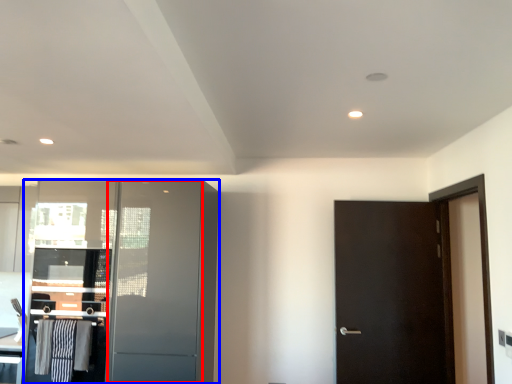
Question: Which of the following is the closest to the observer, screen door (highlighted by a red box) or cabinetry (highlighted by a blue box)?

Choices:
 (A) screen door
 (B) cabinetry

Answer: (A)